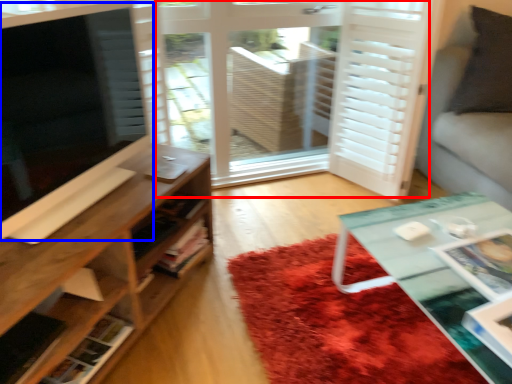
Question: Among these objects, which one is farthest to the camera, screen door (highlighted by a red box) or window screen (highlighted by a blue box)?

Choices:
 (A) screen door
 (B) window screen

Answer: (A)